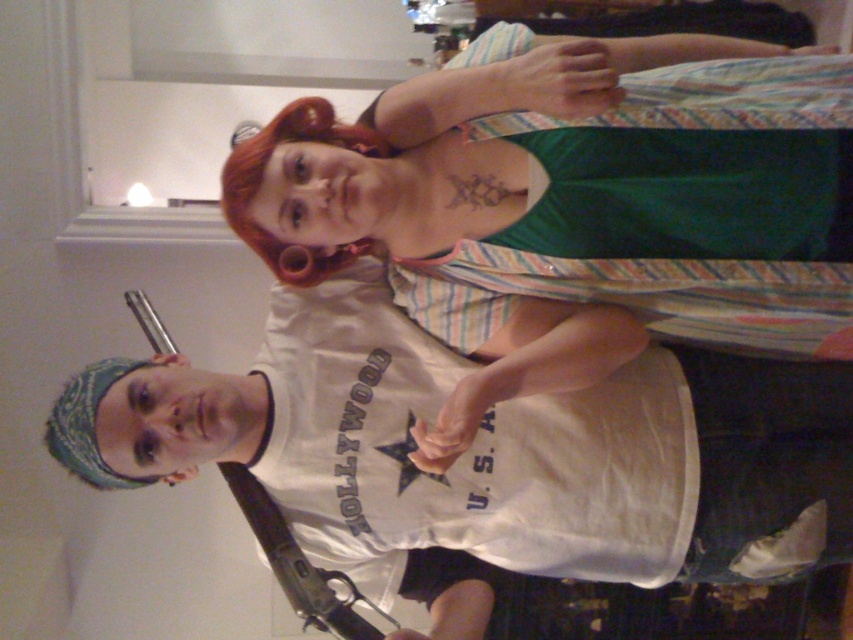
Question: Is white cotton shirt at center thinner than white cotton t-shirt at center?

Choices:
 (A) no
 (B) yes

Answer: (B)

Question: Does white cotton shirt at center appear under white cotton t-shirt at center?

Choices:
 (A) no
 (B) yes

Answer: (A)

Question: Which point is farther from the camera taking this photo?

Choices:
 (A) (352, 310)
 (B) (573, 88)

Answer: (A)

Question: Which object is farther from the camera taking this photo?

Choices:
 (A) white cotton t-shirt at center
 (B) white cotton shirt at center

Answer: (A)

Question: Which point is farther from the camera taking this photo?

Choices:
 (A) (332, 442)
 (B) (540, 358)

Answer: (A)

Question: In this image, where is white cotton shirt at center located relative to white cotton t-shirt at center?

Choices:
 (A) right
 (B) left

Answer: (A)